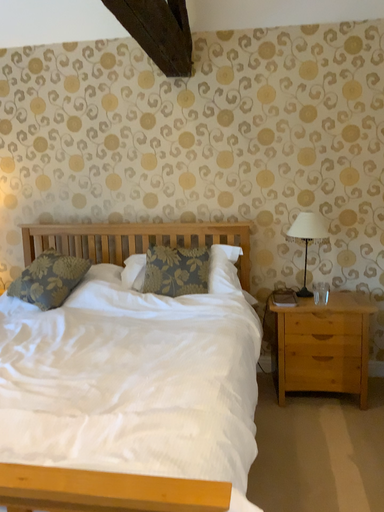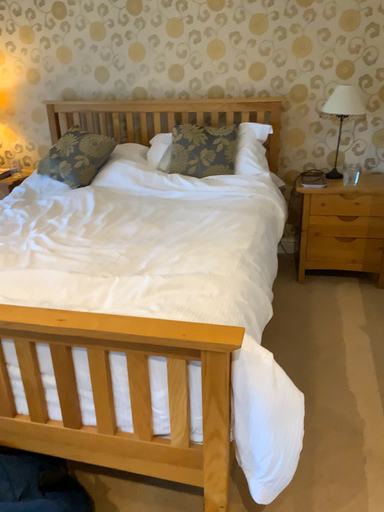
Question: How did the camera likely rotate when shooting the video?

Choices:
 (A) rotated downward
 (B) rotated upward

Answer: (A)